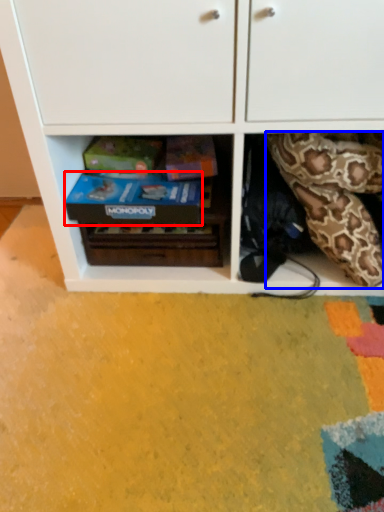
Question: Which object appears farthest to the camera in this image, shoe box (highlighted by a red box) or snake (highlighted by a blue box)?

Choices:
 (A) shoe box
 (B) snake

Answer: (A)